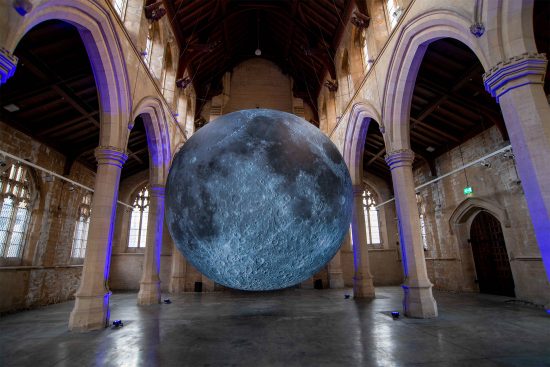
The height and width of the screenshot is (367, 550). Identify the location of pillar. (107, 287).